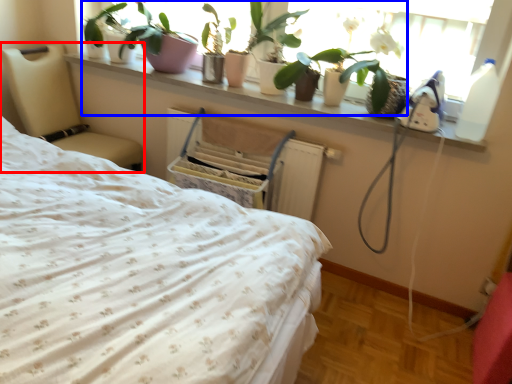
Question: Which of the following is the farthest to the observer, furniture (highlighted by a red box) or plant (highlighted by a blue box)?

Choices:
 (A) furniture
 (B) plant

Answer: (A)